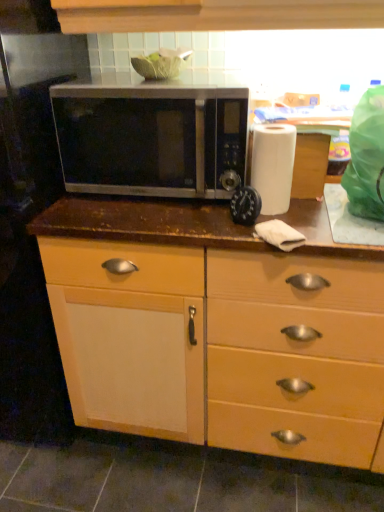
Question: From a real-world perspective, is matte wood cabinet at center located higher than black plastic timer at center?

Choices:
 (A) no
 (B) yes

Answer: (A)

Question: Would you say matte wood cabinet at center contains black plastic timer at center?

Choices:
 (A) no
 (B) yes

Answer: (A)

Question: Can you confirm if matte wood cabinet at center is thinner than black plastic timer at center?

Choices:
 (A) yes
 (B) no

Answer: (B)

Question: From a real-world perspective, is matte wood cabinet at center positioned under black plastic timer at center based on gravity?

Choices:
 (A) yes
 (B) no

Answer: (A)

Question: Is matte wood cabinet at center in contact with black plastic timer at center?

Choices:
 (A) no
 (B) yes

Answer: (A)

Question: Choose the correct answer: Is white matte paper towel at right inside matte wood cabinet at center or outside it?

Choices:
 (A) inside
 (B) outside

Answer: (B)

Question: Considering their positions, is white matte paper towel at right located in front of or behind matte wood cabinet at center?

Choices:
 (A) front
 (B) behind

Answer: (B)

Question: Looking at their shapes, would you say white matte paper towel at right is wider or thinner than matte wood cabinet at center?

Choices:
 (A) wide
 (B) thin

Answer: (B)

Question: Is point (274, 196) positioned closer to the camera than point (200, 410)?

Choices:
 (A) farther
 (B) closer

Answer: (B)

Question: From a real-world perspective, is white matte paper towel at right above or below satin silver microwave at center?

Choices:
 (A) above
 (B) below

Answer: (B)

Question: Considering the positions of white matte paper towel at right and satin silver microwave at center in the image, is white matte paper towel at right wider or thinner than satin silver microwave at center?

Choices:
 (A) thin
 (B) wide

Answer: (A)

Question: Is white matte paper towel at right in front of or behind satin silver microwave at center in the image?

Choices:
 (A) behind
 (B) front

Answer: (A)

Question: Based on their sizes in the image, would you say white matte paper towel at right is bigger or smaller than satin silver microwave at center?

Choices:
 (A) big
 (B) small

Answer: (B)

Question: Is black plastic timer at center situated inside satin silver microwave at center or outside?

Choices:
 (A) outside
 (B) inside

Answer: (A)

Question: In terms of width, does black plastic timer at center look wider or thinner when compared to satin silver microwave at center?

Choices:
 (A) wide
 (B) thin

Answer: (B)